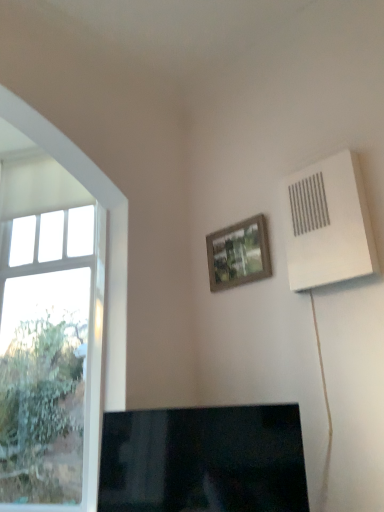
Image resolution: width=384 pixels, height=512 pixels. Describe the element at coordinates (203, 460) in the screenshot. I see `black glossy tv at lower center` at that location.

The height and width of the screenshot is (512, 384). Identify the location of black glossy tv at lower center. 203,460.

This screenshot has height=512, width=384. What do you see at coordinates (327, 224) in the screenshot?
I see `white plastic air conditioning unit at upper right` at bounding box center [327, 224].

The width and height of the screenshot is (384, 512). What do you see at coordinates (106, 230) in the screenshot?
I see `clear glass window at left` at bounding box center [106, 230].

Describe the element at coordinates (238, 254) in the screenshot. The image size is (384, 512). I see `wooden frame at upper center` at that location.

Find the location of a particular element. black glossy tv at lower center is located at coordinates (203, 460).

Is point (352, 184) closer to camera compared to point (116, 371)?

Yes, it is in front of point (116, 371).

Is white plastic air conditioning unit at upper right placed right next to clear glass window at left?

white plastic air conditioning unit at upper right is not next to clear glass window at left, and they're not touching.

From the image's perspective, does white plastic air conditioning unit at upper right appear lower than clear glass window at left?

Incorrect, from the image's perspective, white plastic air conditioning unit at upper right is higher than clear glass window at left.

Considering the relative positions of clear glass window at left and black glossy tv at lower center in the image provided, is clear glass window at left to the left of black glossy tv at lower center from the viewer's perspective?

Yes.

From the image's perspective, who appears lower, clear glass window at left or black glossy tv at lower center?

black glossy tv at lower center is shown below in the image.

Is clear glass window at left taller or shorter than black glossy tv at lower center?

clear glass window at left is taller than black glossy tv at lower center.

Who is more distant, clear glass window at left or black glossy tv at lower center?

clear glass window at left is more distant.

From a real-world perspective, is white plastic air conditioning unit at upper right physically above wooden frame at upper center?

Yes, from a real-world perspective, white plastic air conditioning unit at upper right is above wooden frame at upper center.

Does white plastic air conditioning unit at upper right appear on the right side of wooden frame at upper center?

Correct, you'll find white plastic air conditioning unit at upper right to the right of wooden frame at upper center.

Is white plastic air conditioning unit at upper right inside or outside of wooden frame at upper center?

white plastic air conditioning unit at upper right cannot be found inside wooden frame at upper center.

From the image's perspective, is white plastic air conditioning unit at upper right on wooden frame at upper center?

Yes, from the image's perspective, white plastic air conditioning unit at upper right is above wooden frame at upper center.

Does wooden frame at upper center come in front of white plastic air conditioning unit at upper right?

No, wooden frame at upper center is behind white plastic air conditioning unit at upper right.

Which is nearer, [244,243] or [356,197]?

Positioned in front is point [356,197].

Find the location of `air conditioning above the wooden frame at upper center (from a real-world perspective)`. air conditioning above the wooden frame at upper center (from a real-world perspective) is located at coordinates (327, 224).

Based on their sizes in the image, would you say wooden frame at upper center is bigger or smaller than white plastic air conditioning unit at upper right?

In the image, wooden frame at upper center appears to be smaller than white plastic air conditioning unit at upper right.

Looking at this image, considering their positions, is wooden frame at upper center located in front of or behind clear glass window at left?

wooden frame at upper center is behind clear glass window at left.

From a real-world perspective, is wooden frame at upper center positioned above or below clear glass window at left?

In terms of real-world spatial position, wooden frame at upper center is above clear glass window at left.

Is black glossy tv at lower center far away from clear glass window at left?

They are positioned close to each other.

From the image's perspective, is black glossy tv at lower center above clear glass window at left?

Actually, black glossy tv at lower center appears below clear glass window at left in the image.

Considering the relative positions of black glossy tv at lower center and clear glass window at left in the image provided, is black glossy tv at lower center to the right of clear glass window at left from the viewer's perspective?

Yes, black glossy tv at lower center is to the right of clear glass window at left.

Considering the sizes of objects black glossy tv at lower center and clear glass window at left in the image provided, who is bigger, black glossy tv at lower center or clear glass window at left?

clear glass window at left is bigger.

Who is shorter, black glossy tv at lower center or wooden frame at upper center?

wooden frame at upper center.

Can you confirm if black glossy tv at lower center is positioned to the left of wooden frame at upper center?

Yes, black glossy tv at lower center is to the left of wooden frame at upper center.

How much distance is there between black glossy tv at lower center and wooden frame at upper center?

95.26 centimeters.

Where is `picture frame positioned vertically above the black glossy tv at lower center (from a real-world perspective)`? The height and width of the screenshot is (512, 384). picture frame positioned vertically above the black glossy tv at lower center (from a real-world perspective) is located at coordinates (238, 254).

You are a GUI agent. You are given a task and a screenshot of the screen. Output one action in this format:
    pyautogui.click(x=<x>, y=<y>)
    Task: Click on the air conditioning on the right side of clear glass window at left
    This screenshot has width=384, height=512.
    Given the screenshot: What is the action you would take?
    pyautogui.click(x=327, y=224)

Identify the location of window located on the left of black glossy tv at lower center. (106, 230).

From the image, which object appears to be nearer to black glossy tv at lower center, clear glass window at left or wooden frame at upper center?

The object closer to black glossy tv at lower center is clear glass window at left.

Based on their spatial positions, is clear glass window at left or wooden frame at upper center further from white plastic air conditioning unit at upper right?

The object further to white plastic air conditioning unit at upper right is clear glass window at left.

Which object lies nearer to the anchor point black glossy tv at lower center, white plastic air conditioning unit at upper right or clear glass window at left?

clear glass window at left lies closer to black glossy tv at lower center than the other object.

Which object lies further to the anchor point clear glass window at left, white plastic air conditioning unit at upper right or black glossy tv at lower center?

white plastic air conditioning unit at upper right is positioned further to the anchor clear glass window at left.

From the image, which object appears to be nearer to black glossy tv at lower center, clear glass window at left or white plastic air conditioning unit at upper right?

Among the two, clear glass window at left is located nearer to black glossy tv at lower center.

From the image, which object appears to be farther from clear glass window at left, white plastic air conditioning unit at upper right or wooden frame at upper center?

Based on the image, white plastic air conditioning unit at upper right appears to be further to clear glass window at left.

Based on the photo, from the image, which object appears to be nearer to clear glass window at left, wooden frame at upper center or white plastic air conditioning unit at upper right?

wooden frame at upper center lies closer to clear glass window at left than the other object.

Estimate the real-world distances between objects in this image. Which object is closer to white plastic air conditioning unit at upper right, wooden frame at upper center or black glossy tv at lower center?

The object closer to white plastic air conditioning unit at upper right is wooden frame at upper center.

Identify the location of picture frame situated between clear glass window at left and white plastic air conditioning unit at upper right from left to right. The width and height of the screenshot is (384, 512). (238, 254).

Find the location of a particular element. television between clear glass window at left and white plastic air conditioning unit at upper right is located at coordinates (203, 460).

Image resolution: width=384 pixels, height=512 pixels. I want to click on television located between clear glass window at left and wooden frame at upper center in the left-right direction, so click(203, 460).

This screenshot has width=384, height=512. Find the location of `picture frame between white plastic air conditioning unit at upper right and black glossy tv at lower center in the up-down direction`. picture frame between white plastic air conditioning unit at upper right and black glossy tv at lower center in the up-down direction is located at coordinates (238, 254).